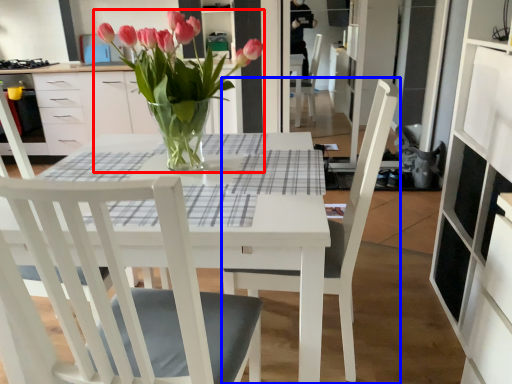
Question: Which object appears farthest to the camera in this image, houseplant (highlighted by a red box) or chair (highlighted by a blue box)?

Choices:
 (A) houseplant
 (B) chair

Answer: (A)